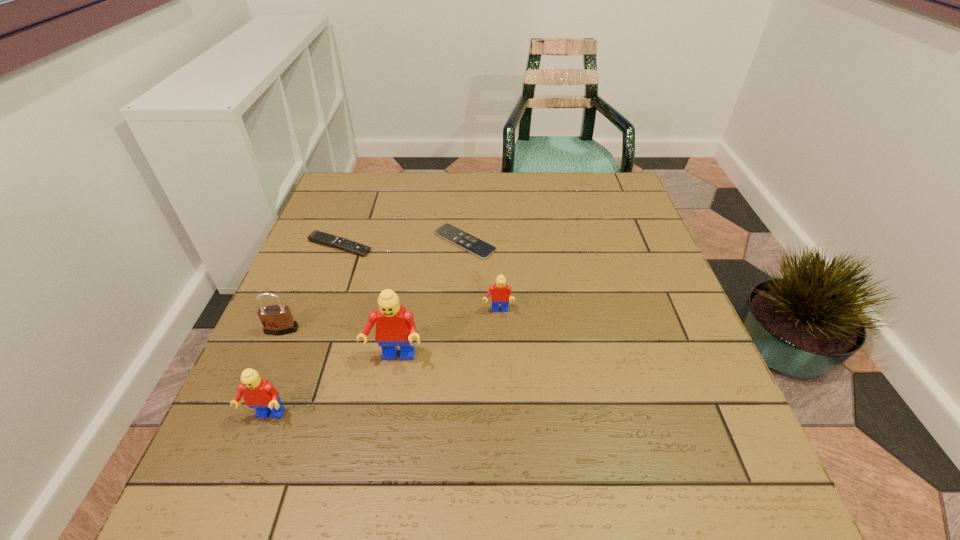
At what (x,y) coordinates should I click in order to perform the action: click on padlock. Please return your answer as a coordinate pair (x, y). Looking at the image, I should click on (276, 319).

At what (x,y) coordinates should I click in order to perform the action: click on blank space located 0.090m on the front-facing side of the fifth farthest object. Please return your answer as a coordinate pair (x, y). The width and height of the screenshot is (960, 540). Looking at the image, I should click on (385, 411).

Find the location of a particular element. The width and height of the screenshot is (960, 540). blank space located on the front-facing side of the farthest Lego is located at coordinates (500, 374).

This screenshot has width=960, height=540. Find the location of `free point located on the right of the second shortest object`. free point located on the right of the second shortest object is located at coordinates (465, 246).

Locate an element on the screen. free region located 0.370m on the front of the right remote control is located at coordinates (459, 387).

Locate an element on the screen. Image resolution: width=960 pixels, height=540 pixels. free spot located 0.140m on the front of the padlock is located at coordinates (254, 394).

The width and height of the screenshot is (960, 540). In order to click on object present at the near edge in this screenshot , I will do `click(258, 393)`.

Locate an element on the screen. Image resolution: width=960 pixels, height=540 pixels. Lego located at the left edge is located at coordinates (258, 393).

Image resolution: width=960 pixels, height=540 pixels. I want to click on remote control that is at the left edge, so click(x=322, y=238).

Locate an element on the screen. padlock positioned at the left edge is located at coordinates (276, 319).